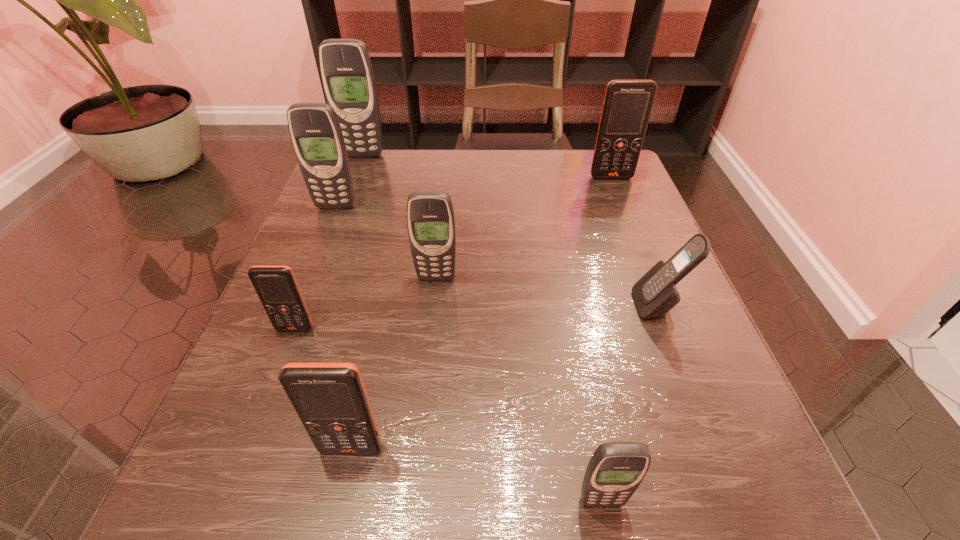
The height and width of the screenshot is (540, 960). In order to click on free location located on the front-facing side of the fifth farthest cellular telephone in this screenshot , I will do click(452, 305).

Find the location of a particular element. The width and height of the screenshot is (960, 540). free space located 0.150m on the front-facing side of the fifth farthest cellular telephone is located at coordinates (546, 305).

Locate an element on the screen. The image size is (960, 540). vacant region located 0.290m on the front-facing side of the fifth farthest cellular telephone is located at coordinates (464, 305).

Where is `vacant area situated on the screen of the third nearest cellular telephone`? Image resolution: width=960 pixels, height=540 pixels. vacant area situated on the screen of the third nearest cellular telephone is located at coordinates (252, 441).

You are a GUI agent. You are given a task and a screenshot of the screen. Output one action in this format:
    pyautogui.click(x=<x>, y=<y>)
    Task: Click on the object that is at the near left corner
    This screenshot has height=540, width=960.
    Given the screenshot: What is the action you would take?
    pyautogui.click(x=330, y=399)

This screenshot has width=960, height=540. In order to click on object at the far right corner in this screenshot , I will do `click(627, 106)`.

This screenshot has height=540, width=960. I want to click on vacant region at the far edge, so click(474, 156).

This screenshot has width=960, height=540. Identify the location of vacant region at the left edge of the desktop. coord(276,360).

Locate an element on the screen. The image size is (960, 540). vacant region at the right edge of the desktop is located at coordinates (592, 237).

The image size is (960, 540). What are the coordinates of `blank area at the far left corner` in the screenshot? It's located at (382, 170).